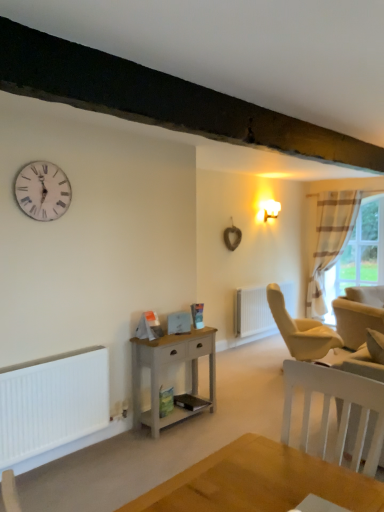
Question: From the image's perspective, is white wooden clock at upper left over white matte radiator at center?

Choices:
 (A) yes
 (B) no

Answer: (A)

Question: From the image's perspective, is white wooden clock at upper left located beneath white matte radiator at center?

Choices:
 (A) yes
 (B) no

Answer: (B)

Question: Are white wooden clock at upper left and white matte radiator at center beside each other?

Choices:
 (A) no
 (B) yes

Answer: (A)

Question: Is white wooden clock at upper left outside of white matte radiator at center?

Choices:
 (A) no
 (B) yes

Answer: (B)

Question: Is the depth of white wooden clock at upper left less than that of white matte radiator at center?

Choices:
 (A) no
 (B) yes

Answer: (B)

Question: Is white wooden clock at upper left far away from white matte radiator at center?

Choices:
 (A) no
 (B) yes

Answer: (B)

Question: Is striped fabric curtain at right taller than white matte heater at lower left?

Choices:
 (A) no
 (B) yes

Answer: (B)

Question: From a real-world perspective, is striped fabric curtain at right over white matte heater at lower left?

Choices:
 (A) no
 (B) yes

Answer: (B)

Question: Considering the relative positions of striped fabric curtain at right and white matte heater at lower left in the image provided, is striped fabric curtain at right to the left of white matte heater at lower left from the viewer's perspective?

Choices:
 (A) no
 (B) yes

Answer: (A)

Question: Can you confirm if striped fabric curtain at right is thinner than white matte heater at lower left?

Choices:
 (A) no
 (B) yes

Answer: (B)

Question: Are striped fabric curtain at right and white matte heater at lower left beside each other?

Choices:
 (A) yes
 (B) no

Answer: (B)

Question: Is striped fabric curtain at right closer to the viewer compared to white matte heater at lower left?

Choices:
 (A) no
 (B) yes

Answer: (A)

Question: Considering the relative sizes of striped fabric curtain at right and plaid fabric curtain at right in the image provided, is striped fabric curtain at right smaller than plaid fabric curtain at right?

Choices:
 (A) yes
 (B) no

Answer: (A)